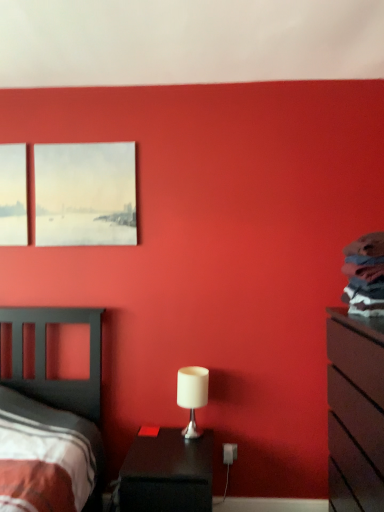
Question: Considering the positions of white matte table lamp at center and black glossy nightstand at lower center in the image, is white matte table lamp at center wider or thinner than black glossy nightstand at lower center?

Choices:
 (A) wide
 (B) thin

Answer: (B)

Question: Would you say white matte table lamp at center is inside or outside black glossy nightstand at lower center?

Choices:
 (A) inside
 (B) outside

Answer: (B)

Question: Estimate the real-world distances between objects in this image. Which object is closer to the white matte table lamp at center?

Choices:
 (A) matte black dresser at right
 (B) black glossy nightstand at lower center
 (C) matte canvas painting at upper left

Answer: (B)

Question: Which object is positioned closest to the matte black dresser at right?

Choices:
 (A) matte canvas painting at upper left
 (B) white matte table lamp at center
 (C) black glossy nightstand at lower center

Answer: (B)